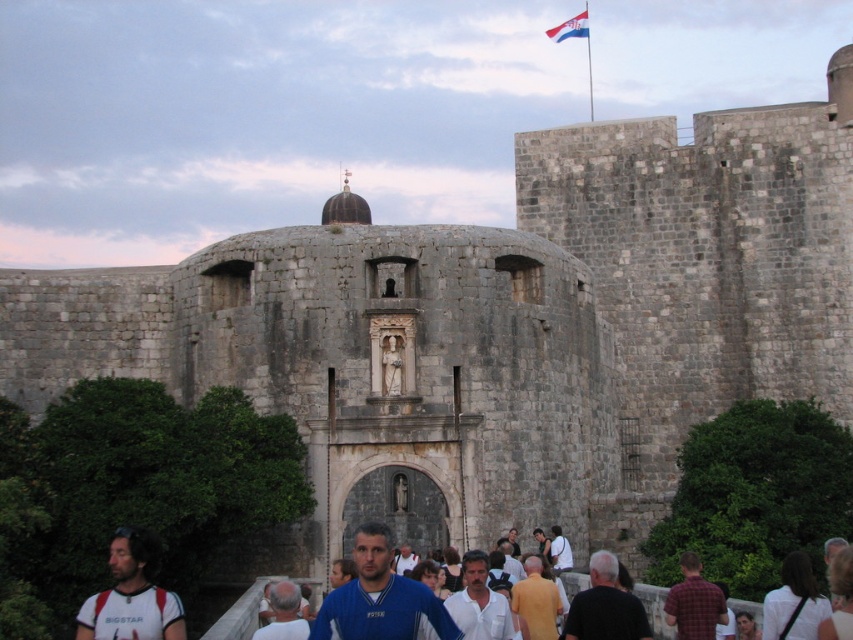
You are a tourist visiting the historic stone structure and see both the white fabric shirt at lower left and the white fabric at lower right. Which one is positioned higher up in the scene?

The white fabric shirt at lower left is located above the white fabric at lower right, so it is positioned higher up in the scene.

Consider the image. You are a tourist visiting the historic stone structure and notice two fabrics in the scene. The white fabric at lower right and the polished fabric flag at upper center. Which one is closer to the ground?

The white fabric at lower right is closer to the ground as it is positioned below the polished fabric flag at upper center.

You are a tourist visiting this historic site and notice two white fabrics. One is the white fabric shirt at lower left and the other is the white fabric at lower right. Which one appears bigger in size?

The white fabric shirt at lower left is larger in size than the white fabric at lower right.